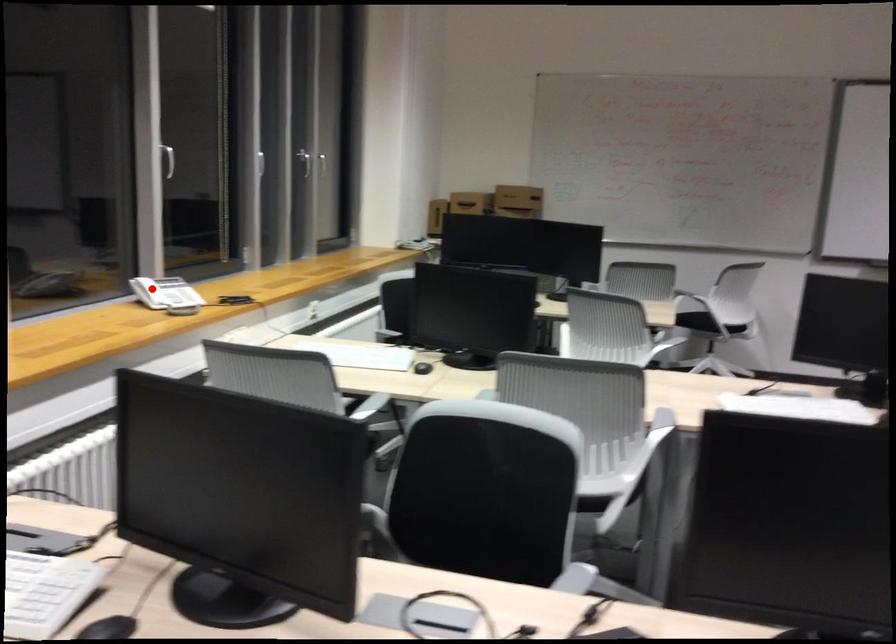
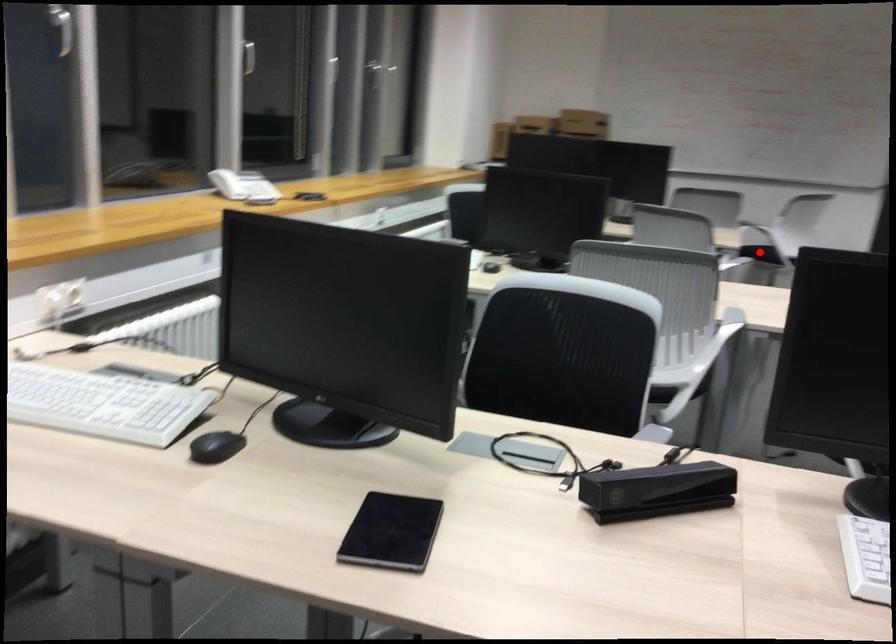
I am providing you with two images of the same scene from different viewpoints. A red point is marked on the first image and another point is marked on the second image. Do the highlighted points in image1 and image2 indicate the same real-world spot?

No